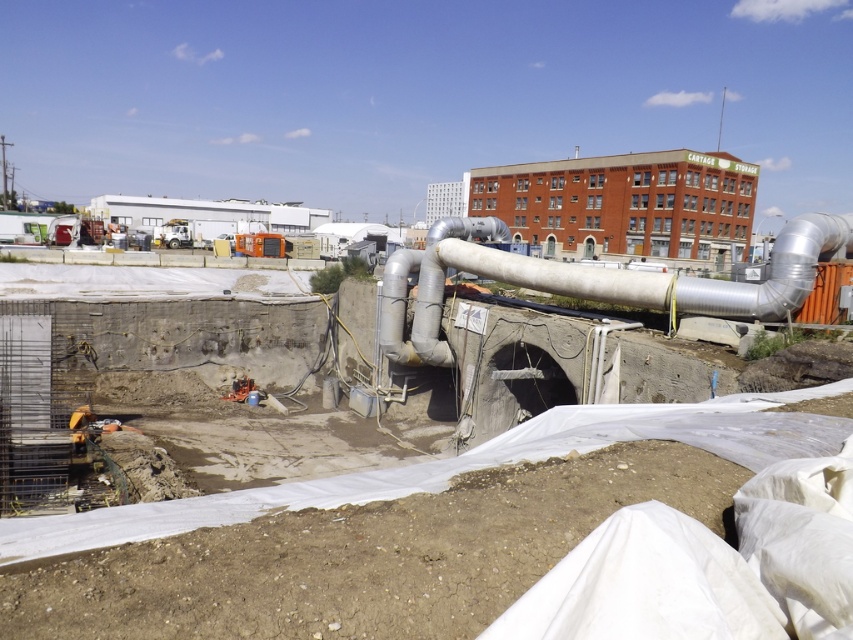
You are an inspector at the construction site. You need to check the stability of the concrete wall at center and the silver metallic pipe at center. According to the scene, which object is positioned lower in the image?

The concrete wall at center is positioned lower than the silver metallic pipe at center in the image.

You are a construction worker who needs to place a new safety sign on the side of the concrete wall at center that faces away from the silver metallic pipe at center. Which direction should you place the sign?

The concrete wall at center is to the left of the silver metallic pipe at center, so the side facing away from the silver metallic pipe at center would be the right side of the concrete wall at center. Place the sign on the right side of the concrete wall at center.

Consider the image. You are a construction worker planning to place a 2m wide steel beam between the concrete wall at center and the silver metallic pipe at center. Can the space between them accommodate the beam?

The concrete wall at center has a lesser width compared to silver metallic pipe at center. Since the beam is 2m wide, the space between them may be sufficient if the combined width of the wall and pipe allows for it. However, without knowing the exact dimensions of the pipe, it is difficult to confirm. Please measure the available space before placing the beam.